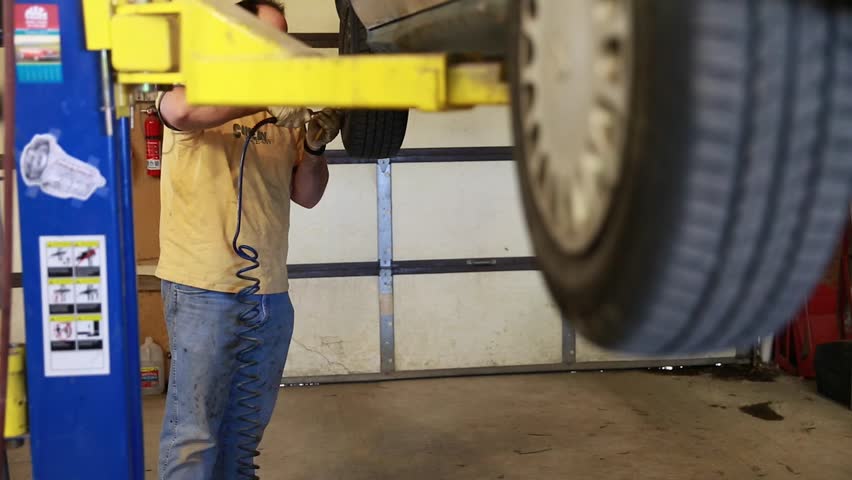
At what (x,y) coordinates should I click in order to perform the action: click on blue support beam. Please return your answer as a coordinate pair (x, y). Looking at the image, I should click on (104, 418).